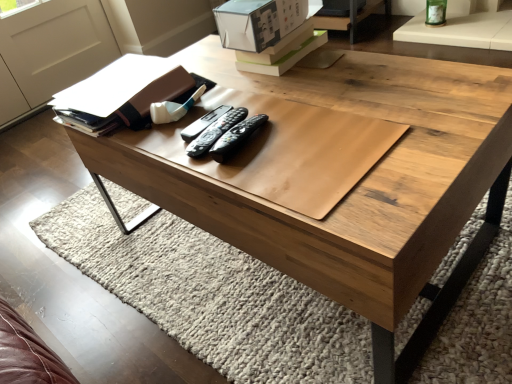
Where is `free space behind black plastic remote at center, marked as the 1th remote in a left-to-right arrangement`? The height and width of the screenshot is (384, 512). free space behind black plastic remote at center, marked as the 1th remote in a left-to-right arrangement is located at coordinates (236, 90).